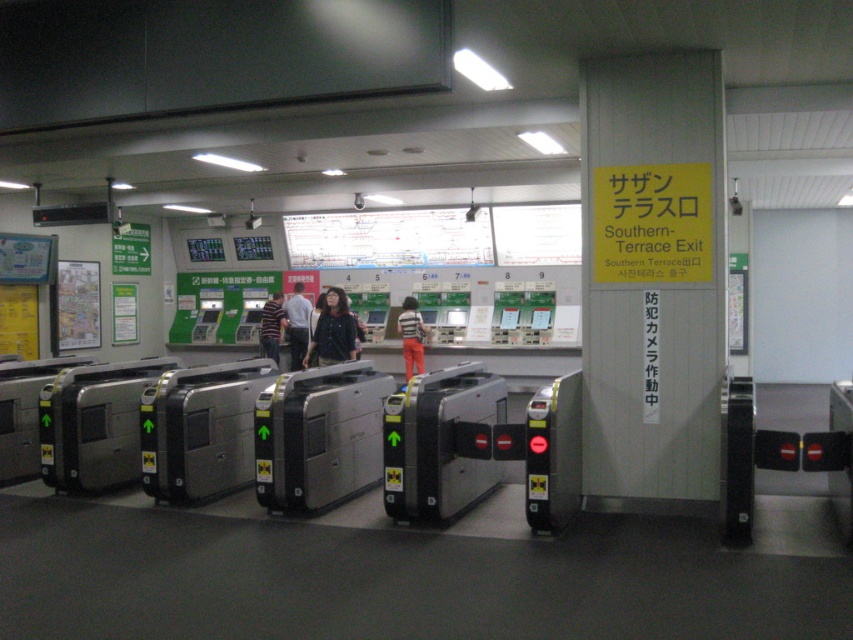
In the scene shown: Between dark blue jacket at center and striped cotton shirt at center, which one has less height?

Standing shorter between the two is dark blue jacket at center.

Is dark blue jacket at center taller than striped cotton shirt at center?

No.

Image resolution: width=853 pixels, height=640 pixels. Identify the location of dark blue jacket at center. (332, 330).

The image size is (853, 640). I want to click on dark blue jacket at center, so click(x=332, y=330).

Can you confirm if dark blue jacket at center is positioned above striped shirt at center?

Correct, dark blue jacket at center is located above striped shirt at center.

Is dark blue jacket at center below striped shirt at center?

No, dark blue jacket at center is not below striped shirt at center.

Image resolution: width=853 pixels, height=640 pixels. What do you see at coordinates (332, 330) in the screenshot?
I see `dark blue jacket at center` at bounding box center [332, 330].

At what (x,y) coordinates should I click in order to perform the action: click on dark blue jacket at center. Please return your answer as a coordinate pair (x, y). Image resolution: width=853 pixels, height=640 pixels. Looking at the image, I should click on (332, 330).

Who is more distant from viewer, (293, 284) or (398, 332)?

Point (293, 284)

Between point (302, 304) and point (412, 328), which one is positioned in front?

Point (412, 328) is more forward.

Who is more forward, (305,324) or (404,364)?

Point (305,324) is more forward.

This screenshot has height=640, width=853. I want to click on dark blue shirt at center, so click(x=297, y=324).